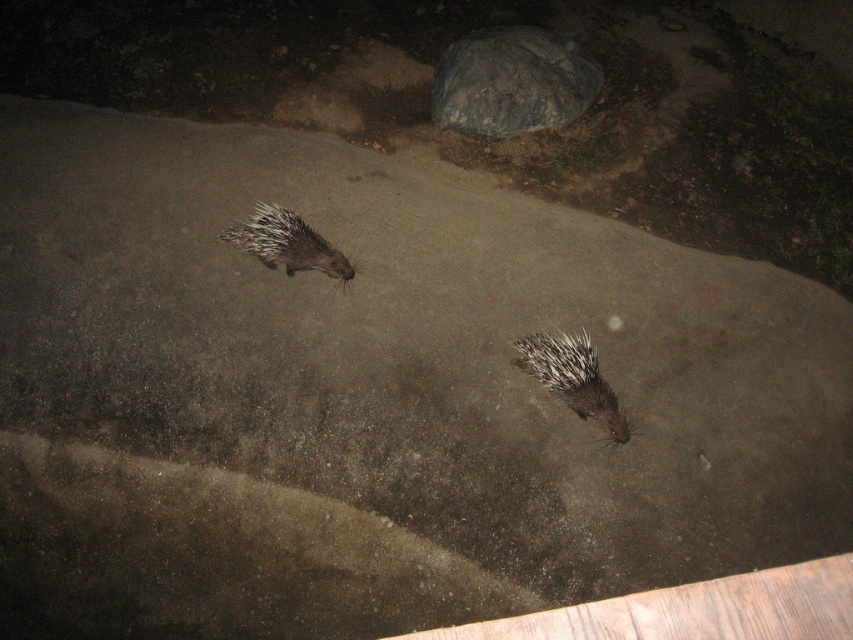
Question: Which point appears farthest from the camera in this image?

Choices:
 (A) (556, 378)
 (B) (281, 244)
 (C) (595, 68)

Answer: (C)

Question: Which point is farther to the camera?

Choices:
 (A) (436, 84)
 (B) (569, 369)
 (C) (344, 264)

Answer: (A)

Question: Is spiky brown hedgehog at lower center thinner than brown spiny hedgehog at center?

Choices:
 (A) no
 (B) yes

Answer: (B)

Question: Does gray rough rock at upper center appear on the right side of spiky brown hedgehog at lower center?

Choices:
 (A) yes
 (B) no

Answer: (B)

Question: Which point is closer to the camera?

Choices:
 (A) coord(531,120)
 (B) coord(602,394)
 (C) coord(318,266)

Answer: (B)

Question: Is gray rough rock at upper center below spiky brown hedgehog at lower center?

Choices:
 (A) no
 (B) yes

Answer: (A)